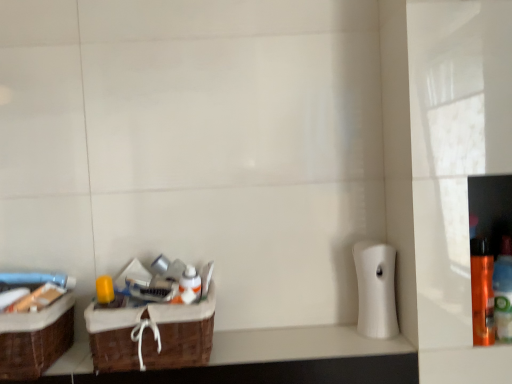
Question: From the image's perspective, is orange glossy spray can at right, which is the second bottle from right to left, above or below white glossy bottle at center?

Choices:
 (A) above
 (B) below

Answer: (B)

Question: From a real-world perspective, is orange glossy spray can at right, which is the second bottle from right to left, above or below white glossy bottle at center?

Choices:
 (A) above
 (B) below

Answer: (B)

Question: Which of these objects is positioned closest to the orange glossy spray can at right, which is the second bottle from right to left?

Choices:
 (A) white matte toilet paper at right
 (B) orange matte bottle at right, marked as the 2th bottle in a left-to-right arrangement
 (C) brown woven basket at lower left
 (D) white glossy bottle at center
 (E) brown woven basket at lower left, the 1th box in the right-to-left sequence

Answer: (B)

Question: Which object is positioned farthest from the brown woven basket at left, positioned as the 1th box in left-to-right order?

Choices:
 (A) brown woven basket at lower left
 (B) orange glossy spray can at right, which is the second bottle from right to left
 (C) orange matte bottle at right, which is counted as the first bottle, starting from the right
 (D) brown woven basket at lower left, the 1th box in the right-to-left sequence
 (E) white glossy bottle at center

Answer: (C)